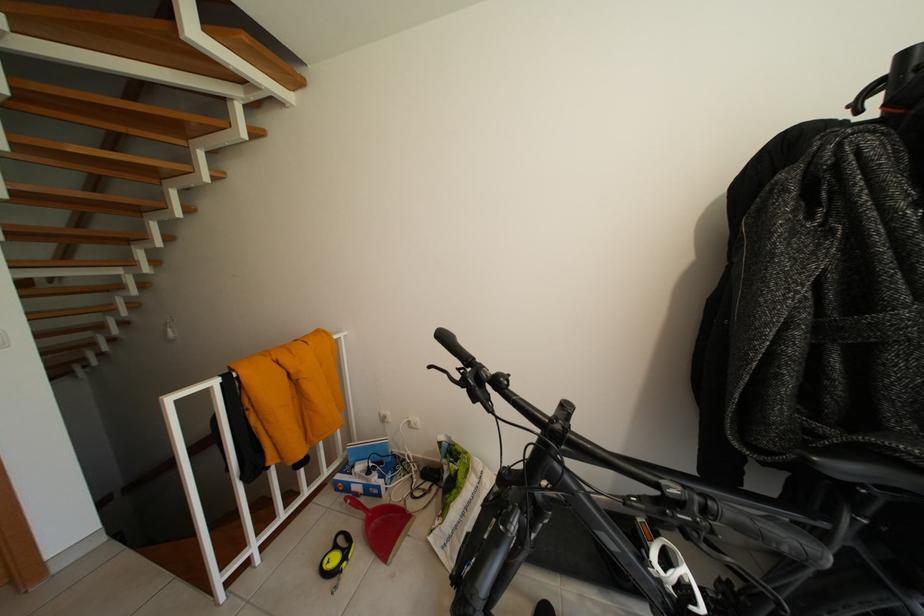
This screenshot has height=616, width=924. Describe the element at coordinates (762, 530) in the screenshot. I see `the black handlebar grip` at that location.